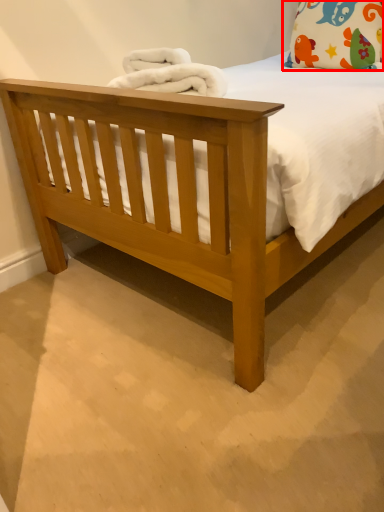
Question: From the image's perspective, where is pillow (annotated by the red box) located relative to material?

Choices:
 (A) above
 (B) below

Answer: (A)